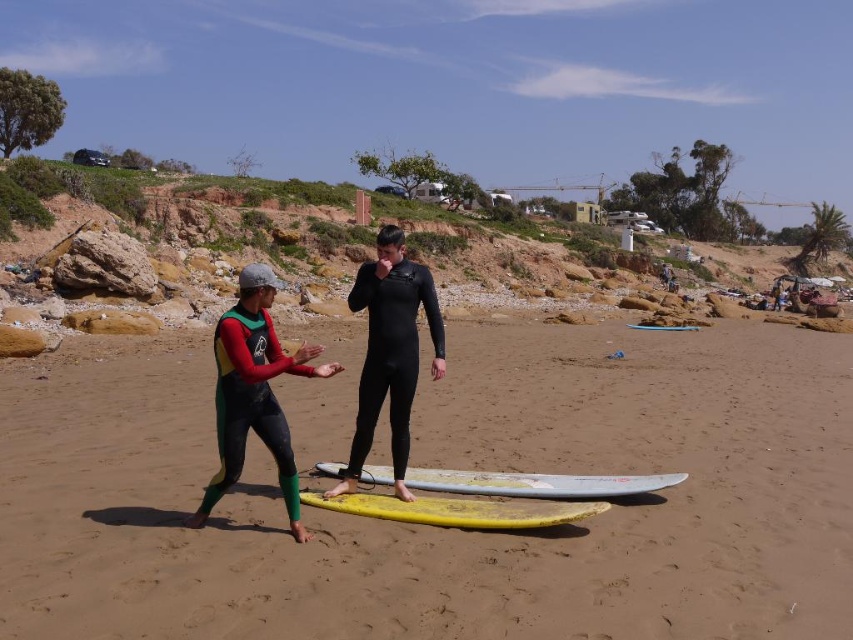
You are a photographer trying to capture a shot of the multicolored neoprene wetsuit at center and the light blue smooth surfboard at center. If you want to ensure both fit in the frame, which object should you position closer to the camera?

The multicolored neoprene wetsuit at center is narrower than the light blue smooth surfboard at center, so you should position the multicolored neoprene wetsuit at center closer to the camera to ensure both fit within the frame.

You are a photographer trying to capture the neon green neoprene wetsuit at center in your shot. Based on the scene description, where should you position your camera relative to the surfboards to ensure the wetsuit is in the frame?

The neon green neoprene wetsuit at center is located at point (254, 394), so you should position your camera between the yellow surfboard closer to the camera and the white surfboard further back to ensure the wetsuit is in the frame.